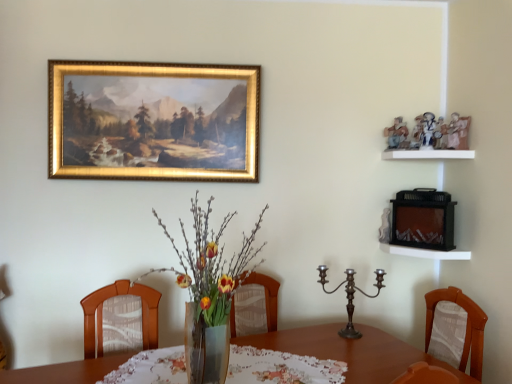
Question: Is polished bronze candelabra at center bigger than gold-framed painting at upper center?

Choices:
 (A) yes
 (B) no

Answer: (B)

Question: From the image's perspective, is polished bronze candelabra at center on top of gold-framed painting at upper center?

Choices:
 (A) no
 (B) yes

Answer: (A)

Question: Is polished bronze candelabra at center oriented towards gold-framed painting at upper center?

Choices:
 (A) yes
 (B) no

Answer: (B)

Question: Is polished bronze candelabra at center directly adjacent to gold-framed painting at upper center?

Choices:
 (A) yes
 (B) no

Answer: (B)

Question: Is polished bronze candelabra at center turned away from gold-framed painting at upper center?

Choices:
 (A) yes
 (B) no

Answer: (B)

Question: Can you confirm if polished bronze candelabra at center is smaller than gold-framed painting at upper center?

Choices:
 (A) yes
 (B) no

Answer: (A)

Question: Can we say translucent glass vase at center lies outside gold-framed painting at upper center?

Choices:
 (A) no
 (B) yes

Answer: (B)

Question: Considering the relative sizes of translucent glass vase at center and gold-framed painting at upper center in the image provided, is translucent glass vase at center taller than gold-framed painting at upper center?

Choices:
 (A) no
 (B) yes

Answer: (B)

Question: From a real-world perspective, is translucent glass vase at center physically below gold-framed painting at upper center?

Choices:
 (A) no
 (B) yes

Answer: (B)

Question: Is gold-framed painting at upper center inside translucent glass vase at center?

Choices:
 (A) no
 (B) yes

Answer: (A)

Question: Considering the relative sizes of translucent glass vase at center and gold-framed painting at upper center in the image provided, is translucent glass vase at center bigger than gold-framed painting at upper center?

Choices:
 (A) no
 (B) yes

Answer: (B)

Question: Is translucent glass vase at center facing towards gold-framed painting at upper center?

Choices:
 (A) yes
 (B) no

Answer: (B)

Question: Is printed fabric tablecloth at center looking in the opposite direction of gold-framed painting at upper center?

Choices:
 (A) yes
 (B) no

Answer: (B)